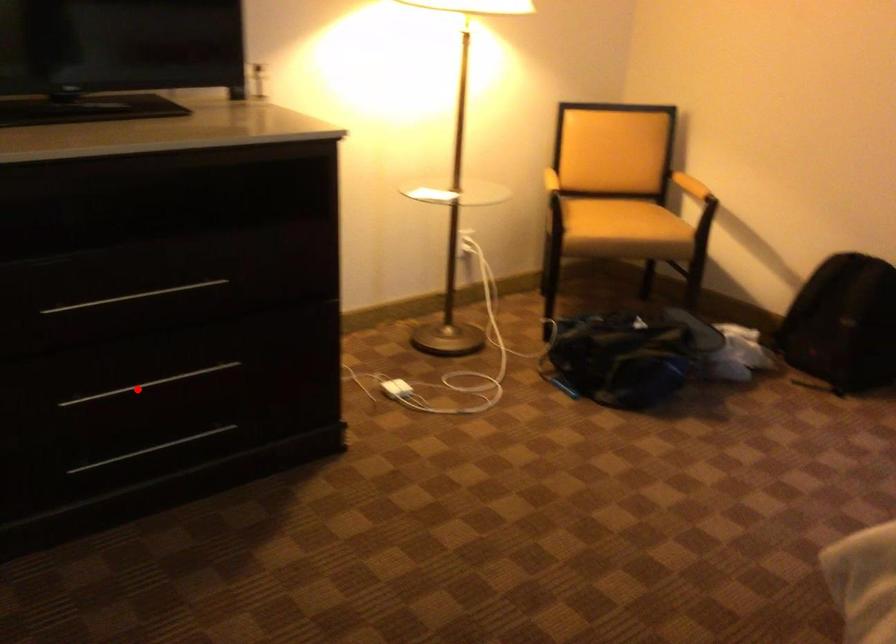
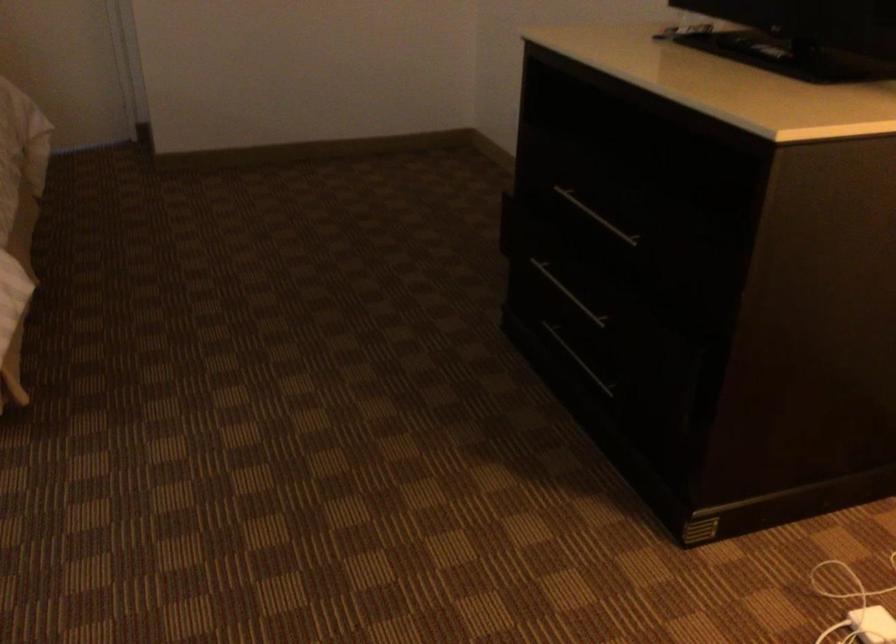
Locate, in the second image, the point that corresponds to the highlighted location in the first image.

(567, 292)